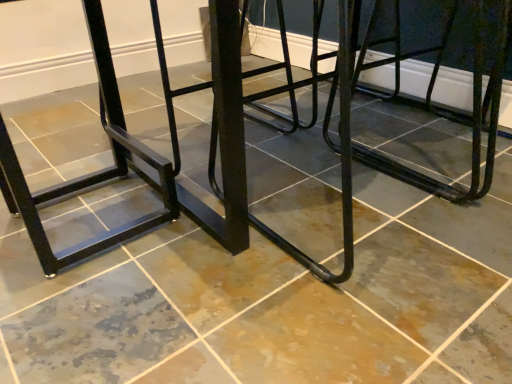
Question: From the image's perspective, is black metal table at center positioned above or below black matte metal bar stool at left?

Choices:
 (A) above
 (B) below

Answer: (A)

Question: From a real-world perspective, is black metal table at center physically located above or below black matte metal bar stool at left?

Choices:
 (A) above
 (B) below

Answer: (A)

Question: Relative to black matte metal bar stool at left, is black metal table at center in front or behind?

Choices:
 (A) front
 (B) behind

Answer: (A)

Question: Based on their positions, is black matte metal bar stool at left located to the left or right of black metal table at center?

Choices:
 (A) right
 (B) left

Answer: (B)

Question: Considering the positions of point (119, 165) and point (164, 203), is point (119, 165) closer or farther from the camera than point (164, 203)?

Choices:
 (A) farther
 (B) closer

Answer: (A)

Question: Based on their sizes in the image, would you say black matte metal bar stool at left is bigger or smaller than black metal table at center?

Choices:
 (A) small
 (B) big

Answer: (A)

Question: Is black matte metal bar stool at left wider or thinner than black metal table at center?

Choices:
 (A) thin
 (B) wide

Answer: (A)